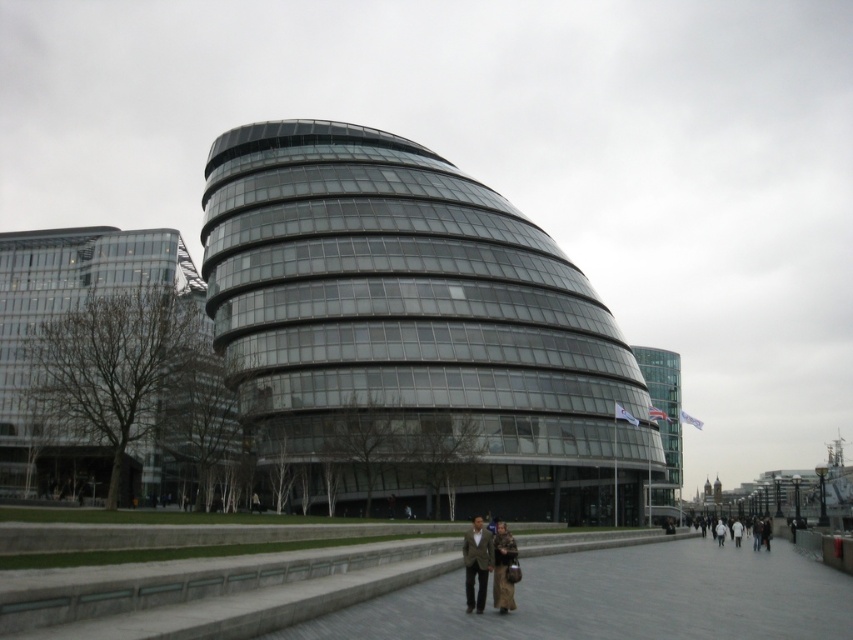
You are a photographer standing at a certain point wanting to capture the transparent glass building at center in your shot. The camera you are using has a maximum focal length of 50mm. Considering the distance between you and the building, will you need to move closer or farther away to ensure the building fits entirely within the frame?

The transparent glass building at center is 62.62 meters away from the camera. Since the maximum focal length of 50mm is suitable for capturing distant subjects, you would not need to move closer. The building should fit within the frame at this distance.

You are a delivery person standing at the entrance of the curved glass building. You need to deliver a package to the person wearing the brown leather coat at center and the matte brown coat at center. Can you reach both of them without moving more than 30 meters from your current position?

The brown leather coat at center and matte brown coat at center are 35.84 meters apart, which is more than 30 meters. Therefore, you cannot reach both without moving more than 30 meters from your current position.

You are standing in front of the modern curved glass building and see two coats at the center of the walkway. Which coat is nearer to you, the brown leather coat at center or the matte brown coat at center?

The brown leather coat at center is closer to the viewer than the matte brown coat at center, so the brown leather coat at center is nearer to you.